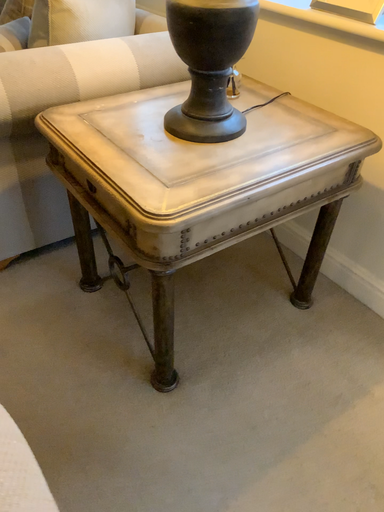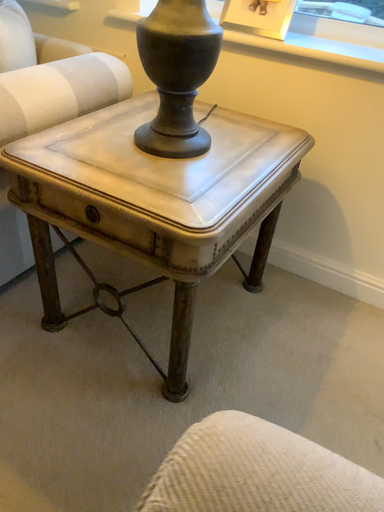
Question: Which way did the camera rotate in the video?

Choices:
 (A) rotated left
 (B) rotated right

Answer: (B)